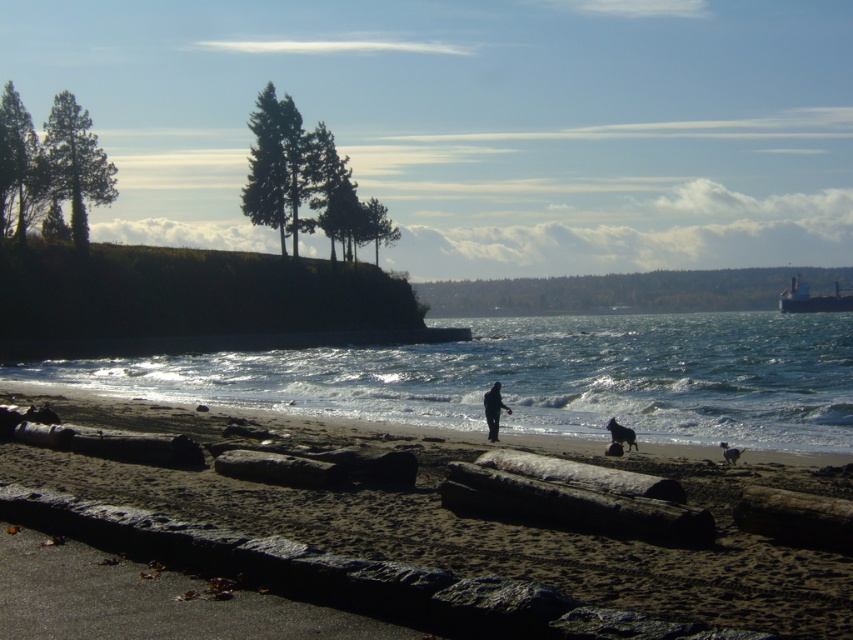
Question: Which point is closer to the camera?

Choices:
 (A) metallic gray ship at upper right
 (B) black matte dog at lower center
 (C) dark brown sand at center

Answer: (C)

Question: Is clear water at center bigger than metallic gray ship at upper right?

Choices:
 (A) no
 (B) yes

Answer: (B)

Question: Is metallic gray ship at upper right further to camera compared to black matte dog at lower center?

Choices:
 (A) no
 (B) yes

Answer: (B)

Question: Can you confirm if dark brown sand at center is bigger than black matte jacket at center?

Choices:
 (A) yes
 (B) no

Answer: (A)

Question: Estimate the real-world distances between objects in this image. Which object is closer to the black matte jacket at center?

Choices:
 (A) clear water at center
 (B) black matte dog at lower center

Answer: (B)

Question: Which of these objects is positioned closest to the black matte dog at lower center?

Choices:
 (A) metallic gray ship at upper right
 (B) black matte jacket at center

Answer: (B)